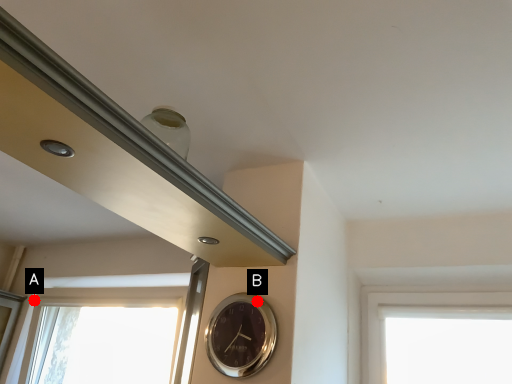
Question: Two points are circled on the image, labeled by A and B beside each circle. Which of the following is the farthest from the observer?

Choices:
 (A) A is further
 (B) B is further

Answer: (A)